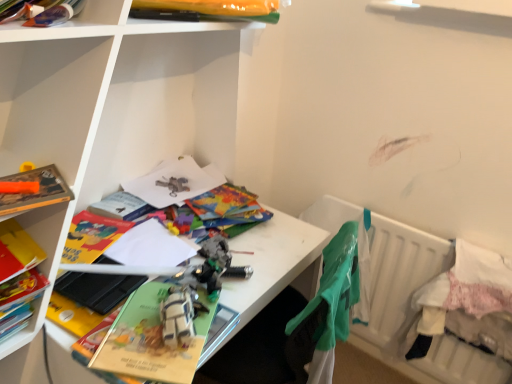
Question: Is green fabric at right shorter than hardcover book at left, arranged as the first book when viewed from the left?

Choices:
 (A) yes
 (B) no

Answer: (B)

Question: Can you confirm if green fabric at right is positioned to the left of hardcover book at left, arranged as the second book when viewed from the right?

Choices:
 (A) yes
 (B) no

Answer: (B)

Question: Is green fabric at right far from hardcover book at left, arranged as the second book when viewed from the right?

Choices:
 (A) yes
 (B) no

Answer: (B)

Question: Considering the relative positions of green fabric at right and hardcover book at left, marked as the second book in a top-to-bottom arrangement, in the image provided, is green fabric at right to the right of hardcover book at left, marked as the second book in a top-to-bottom arrangement, from the viewer's perspective?

Choices:
 (A) yes
 (B) no

Answer: (A)

Question: Considering the relative sizes of green fabric at right and hardcover book at left, marked as the second book in a top-to-bottom arrangement, in the image provided, is green fabric at right thinner than hardcover book at left, marked as the second book in a top-to-bottom arrangement,?

Choices:
 (A) yes
 (B) no

Answer: (A)

Question: Is point (80, 18) positioned closer to the camera than point (327, 326)?

Choices:
 (A) farther
 (B) closer

Answer: (B)

Question: Choose the correct answer: Is matte plastic books at upper left, the first shelf viewed from the top, inside green fabric at right or outside it?

Choices:
 (A) inside
 (B) outside

Answer: (B)

Question: Considering the positions of matte plastic books at upper left, which is the first shelf from left to right, and green fabric at right in the image, is matte plastic books at upper left, which is the first shelf from left to right, bigger or smaller than green fabric at right?

Choices:
 (A) small
 (B) big

Answer: (A)

Question: Is matte plastic books at upper left, the first shelf viewed from the top, wider or thinner than green fabric at right?

Choices:
 (A) wide
 (B) thin

Answer: (B)

Question: From a real-world perspective, is white fabric bed at lower right, which appears as the 1th bed when viewed from the front, above or below matte orange book at left, which is the 1th paperback book from left to right?

Choices:
 (A) above
 (B) below

Answer: (B)

Question: From the image's perspective, relative to matte orange book at left, the 2th paperback book when ordered from bottom to top, is white fabric bed at lower right, which appears as the 1th bed when viewed from the front, above or below?

Choices:
 (A) above
 (B) below

Answer: (B)

Question: Does point (429, 299) appear closer or farther from the camera than point (9, 201)?

Choices:
 (A) farther
 (B) closer

Answer: (A)

Question: Is white fabric bed at lower right, which appears as the 1th bed when viewed from the front, taller or shorter than matte orange book at left, the 2th paperback book when ordered from bottom to top?

Choices:
 (A) tall
 (B) short

Answer: (A)

Question: Would you say white fabric bed at lower right, the 2th bed positioned from the back, is inside or outside yellow plastic bag at upper center, which ranks as the 2th book in left-to-right order?

Choices:
 (A) outside
 (B) inside

Answer: (A)

Question: Is point (458, 279) positioned closer to the camera than point (224, 11)?

Choices:
 (A) closer
 (B) farther

Answer: (B)